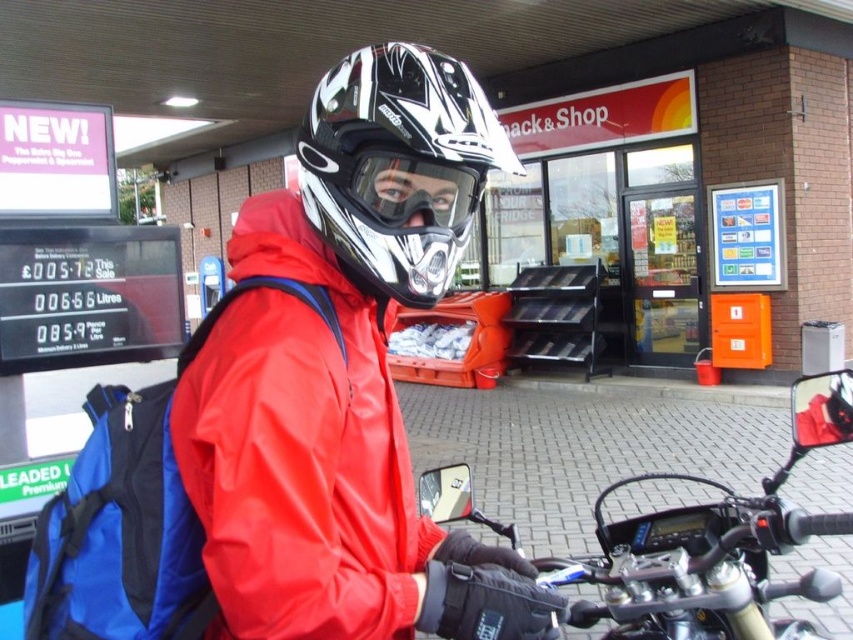
Question: Is glossy white helmet at center below matte black goggles at center?

Choices:
 (A) yes
 (B) no

Answer: (B)

Question: Which of the following is the farthest from the observer?

Choices:
 (A) gold metallic motorcycle at center
 (B) glossy white helmet at center
 (C) matte black helmet at center

Answer: (A)

Question: Which object is farther from the camera taking this photo?

Choices:
 (A) matte black goggles at center
 (B) matte black helmet at center
 (C) gold metallic motorcycle at center
 (D) glossy white helmet at center

Answer: (C)

Question: Is the position of gold metallic motorcycle at center more distant than that of matte black goggles at center?

Choices:
 (A) no
 (B) yes

Answer: (B)

Question: Which of the following is the farthest from the observer?

Choices:
 (A) (445, 518)
 (B) (448, 192)
 (C) (196, 481)
 (D) (457, 253)

Answer: (A)

Question: Can you confirm if matte black helmet at center is positioned to the right of gold metallic motorcycle at center?

Choices:
 (A) no
 (B) yes

Answer: (A)